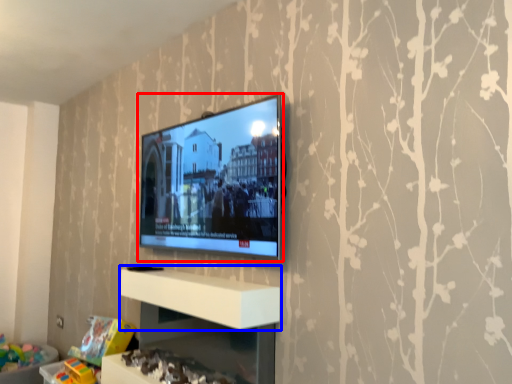
Question: Among these objects, which one is farthest to the camera, television (highlighted by a red box) or shelf (highlighted by a blue box)?

Choices:
 (A) television
 (B) shelf

Answer: (A)